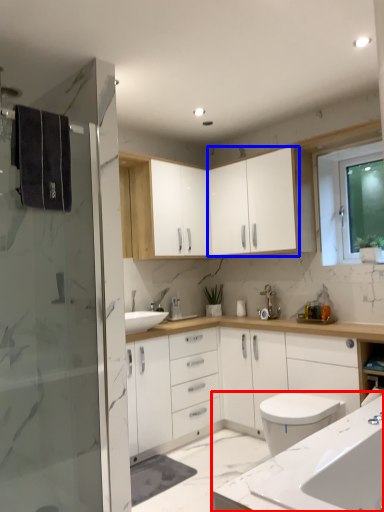
Question: Among these objects, which one is farthest to the camera, countertop (highlighted by a red box) or cabinetry (highlighted by a blue box)?

Choices:
 (A) countertop
 (B) cabinetry

Answer: (B)